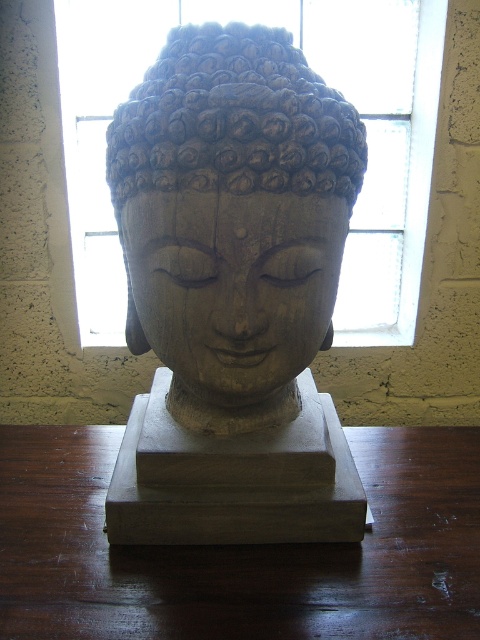
Is brown wood table at center below transparent glass window at center?

Yes.

Is point (419, 570) less distant than point (321, 54)?

Yes, it is.

Find the location of a particular element. Image resolution: width=480 pixels, height=640 pixels. brown wood table at center is located at coordinates (240, 550).

Does wooden statue at center appear on the right side of wooden sculpture at center?

Indeed, wooden statue at center is positioned on the right side of wooden sculpture at center.

Describe the element at coordinates (233, 292) in the screenshot. I see `wooden statue at center` at that location.

This screenshot has height=640, width=480. In order to click on wooden statue at center in this screenshot , I will do `click(233, 292)`.

Does brown wood table at center have a greater height compared to wooden sculpture at center?

No.

Is brown wood table at center below wooden sculpture at center?

Yes, brown wood table at center is below wooden sculpture at center.

Between point (414, 435) and point (245, 284), which one is positioned behind?

Positioned behind is point (414, 435).

You are a GUI agent. You are given a task and a screenshot of the screen. Output one action in this format:
    pyautogui.click(x=<x>, y=<y>)
    Task: Click on the brown wood table at center
    Image resolution: width=480 pixels, height=640 pixels.
    Given the screenshot: What is the action you would take?
    pyautogui.click(x=240, y=550)